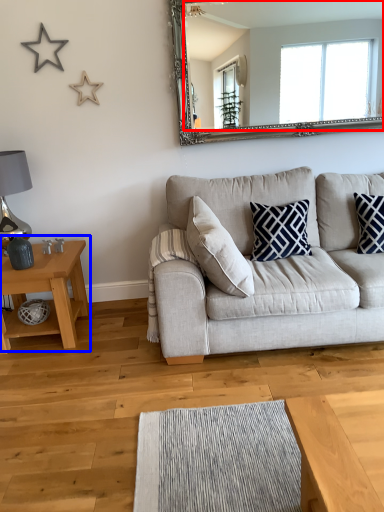
Question: Which point is further to the camera, mirror (highlighted by a red box) or table (highlighted by a blue box)?

Choices:
 (A) mirror
 (B) table

Answer: (A)